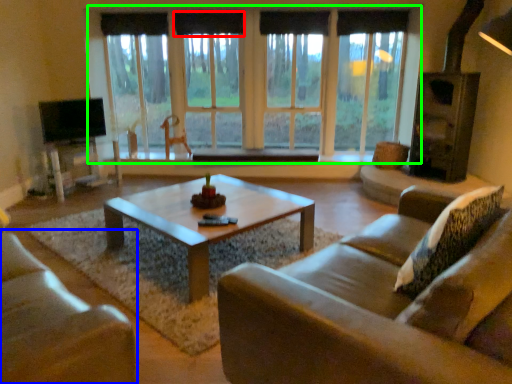
Question: Considering the real-world distances, which object is farthest from curtain (highlighted by a red box)? studio couch (highlighted by a blue box) or window (highlighted by a green box)?

Choices:
 (A) studio couch
 (B) window

Answer: (A)